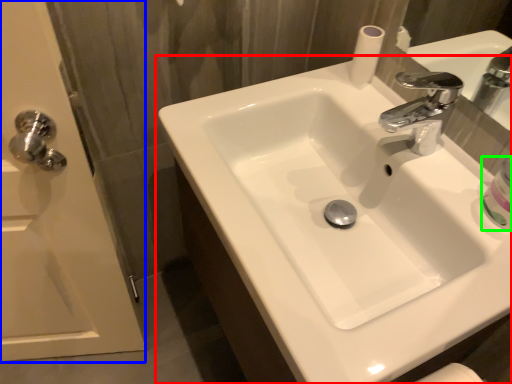
Question: Which object is the farthest from sink (highlighted by a red box)? Choose among these: screen door (highlighted by a blue box) or mouthwash (highlighted by a green box).

Choices:
 (A) screen door
 (B) mouthwash

Answer: (A)